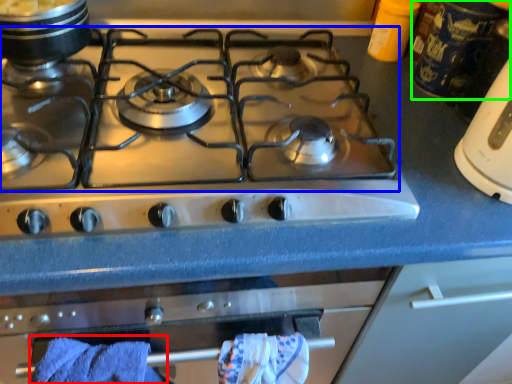
Question: Which object is positioned closest to bath towel (highlighted by a red box)? Select from gas stove (highlighted by a blue box) and appliance (highlighted by a green box).

Choices:
 (A) gas stove
 (B) appliance

Answer: (A)